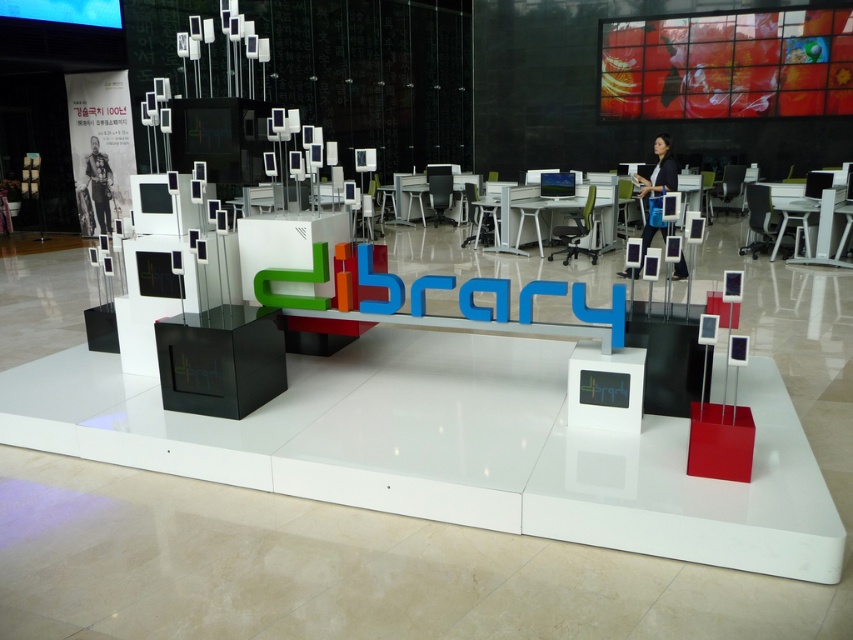
You are a visitor who wants to sit down while looking at the library sign. There are two chairs available, a matte white chair at center and a white plastic chair at center. Which chair is closer to the library sign?

Both the matte white chair at center and the white plastic chair at center are at the same center position, so they are equally close to the library sign.

You are standing at the entrance of the library and want to sit down. There is a matte white chair at center. Can you walk straight from the entrance to reach it without any obstacles?

The matte white chair at center is located at point (480,218), which suggests it is centrally positioned. Since there are no obstacles mentioned between the entrance and the chair, you can walk straight to reach it.

You are standing in the library and want to sit down. The black plastic chair at right is located at coordinates 0.344, 0.891. If you are at the origin point, which direction should you move to reach the chair?

The black plastic chair at right is located at coordinates (759, 220). Since the x and y coordinates are both positive, you should move to the right and forward to reach the chair.